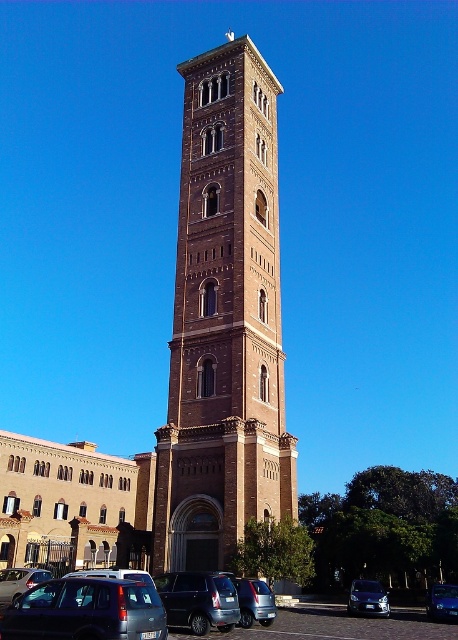
Question: Observing the image, what is the correct spatial positioning of metallic silver car at lower left in reference to metallic blue car at center?

Choices:
 (A) above
 (B) below

Answer: (A)

Question: Which point appears closest to the camera in this image?

Choices:
 (A) (222, 131)
 (B) (372, 580)
 (C) (213, 602)

Answer: (C)

Question: From the image, what is the correct spatial relationship of brown brick tower at center in relation to metallic silver car at lower left?

Choices:
 (A) above
 (B) below

Answer: (A)

Question: Which point appears farthest from the camera in this image?

Choices:
 (A) (17, 632)
 (B) (365, 604)

Answer: (B)

Question: Which point is farther to the camera?

Choices:
 (A) (385, 600)
 (B) (245, 387)

Answer: (B)

Question: Is brown brick tower at center further to the viewer compared to metallic blue sedan at lower center?

Choices:
 (A) no
 (B) yes

Answer: (A)